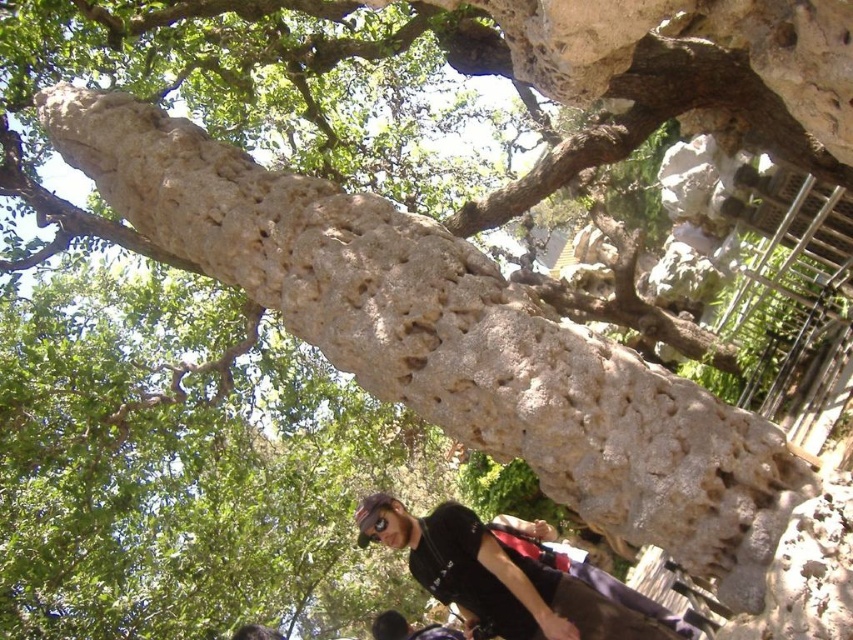
You are a skateboarder who wants to place your matte black goggles at center on the ground near your black matte skateboarder at center. Given that the space between them is 2.00 meters, is there enough room to safely place the goggles without them being too far away?

The black matte skateboarder at center and matte black goggles at center are 2.00 meters apart. Since 2.00 meters is a reasonable distance for placing the goggles near the skateboarder, there is enough room to safely place them without being too far away.

You are a photographer planning to take a photo of the black matte skateboarder at center and the matte black goggles at center. You want to ensure both are visible in the frame. Based on their positions, which object should you focus on first to capture both in the shot?

The black matte skateboarder at center is located below the matte black goggles at center, so focusing on the matte black goggles at center first will ensure both are in the frame as the skateboarder is positioned lower.